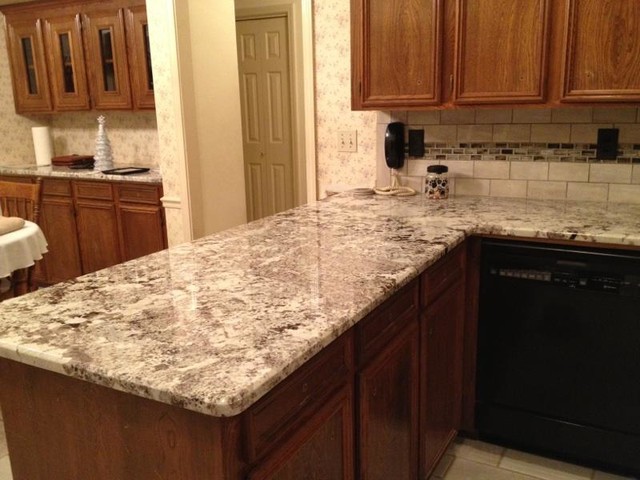
Identify the location of 2 marble countertops. This screenshot has height=480, width=640. (89, 171), (221, 333), (262, 122).